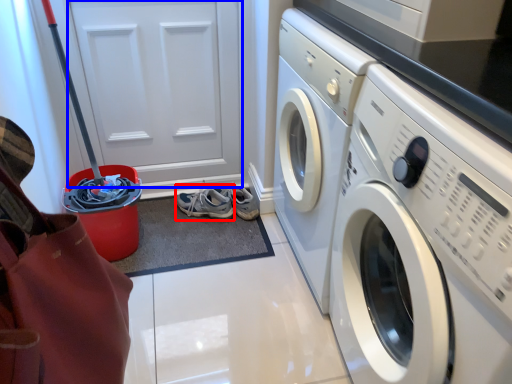
Question: Which object is further to the camera taking this photo, running shoe (highlighted by a red box) or door (highlighted by a blue box)?

Choices:
 (A) running shoe
 (B) door

Answer: (A)